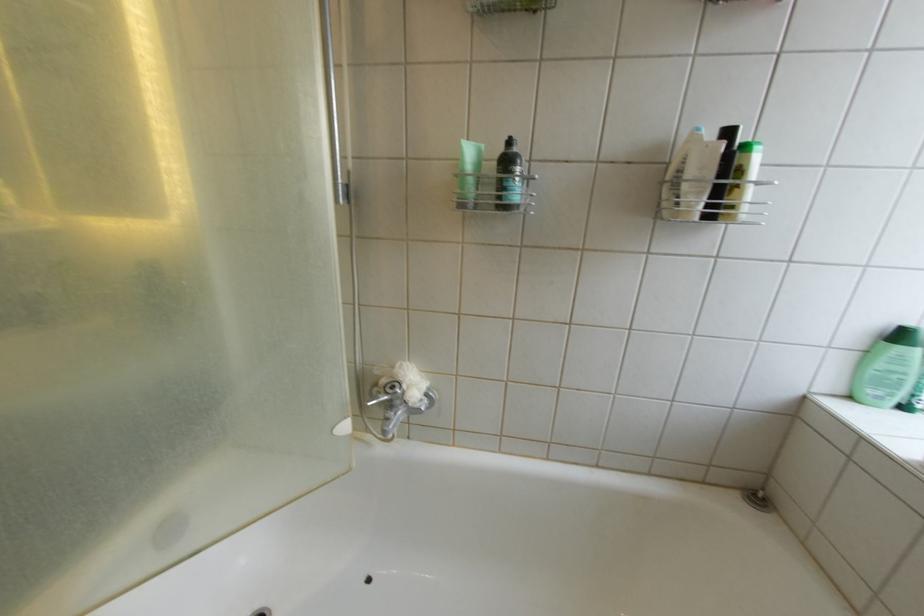
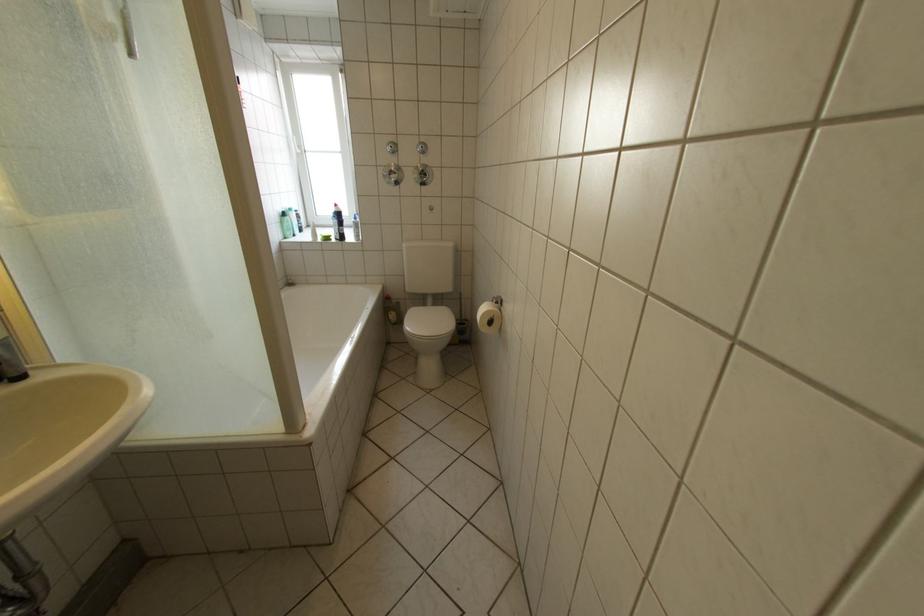
In the second image, find the point that corresponds to point 880,353 in the first image.

(294, 224)